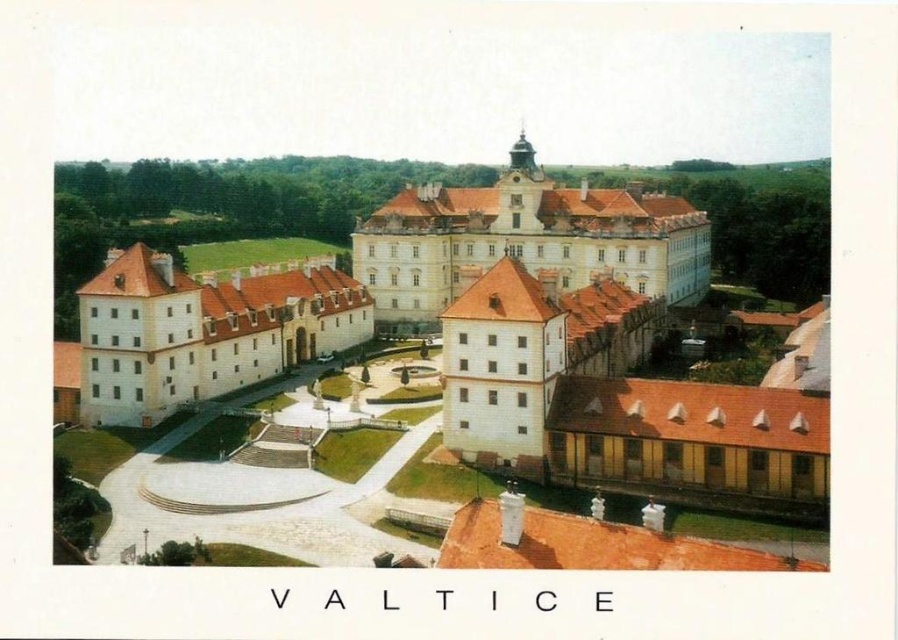
You are standing in the courtyard of the white stone castle at center and want to walk towards the white matte building at left. Which direction should you face to walk directly towards it?

You should face towards the left direction to walk directly towards the white matte building at left from the white stone castle at center since the white stone castle at center is positioned over the white matte building at left.

You are a tourist visiting this historical site and want to take a photo that includes both the white stone castle at center and the white matte building at left. Which building should you position closer to the camera to ensure both are fully visible in the frame?

To ensure both the white stone castle at center and the white matte building at left are fully visible in the frame, position the white matte building at left closer to the camera since it is smaller than the white stone castle at center.